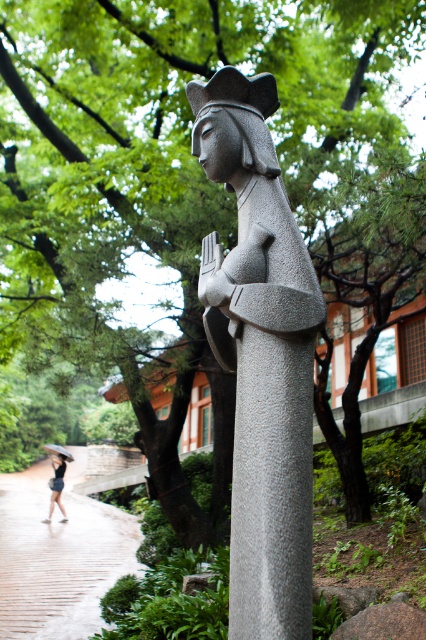
Question: Is matte black dress at lower left below transparent plastic umbrella at lower left?

Choices:
 (A) yes
 (B) no

Answer: (A)

Question: Does granite statue at center have a greater width compared to brown brick path at lower left?

Choices:
 (A) no
 (B) yes

Answer: (A)

Question: Which point appears closest to the camera in this image?

Choices:
 (A) (250, 604)
 (B) (54, 477)

Answer: (A)

Question: Is the position of granite statue at center less distant than that of matte black dress at lower left?

Choices:
 (A) no
 (B) yes

Answer: (B)

Question: Which point appears farthest from the camera in this image?

Choices:
 (A) (46, 518)
 (B) (8, 496)
 (C) (236, 544)

Answer: (B)

Question: Which object is closer to the camera taking this photo?

Choices:
 (A) matte black dress at lower left
 (B) transparent plastic umbrella at lower left
 (C) brown brick path at lower left
 (D) granite statue at center

Answer: (D)